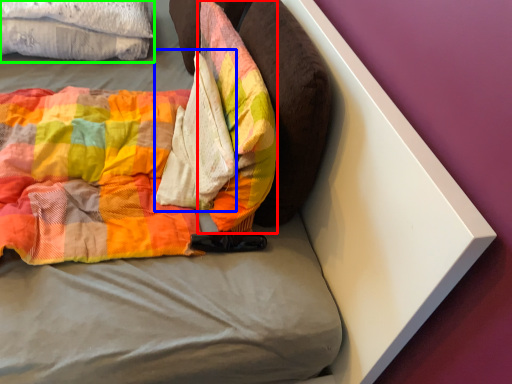
Question: Estimate the real-world distances between objects in this image. Which object is farther from pillow (highlighted by a red box), material (highlighted by a blue box) or cloth (highlighted by a green box)?

Choices:
 (A) material
 (B) cloth

Answer: (B)